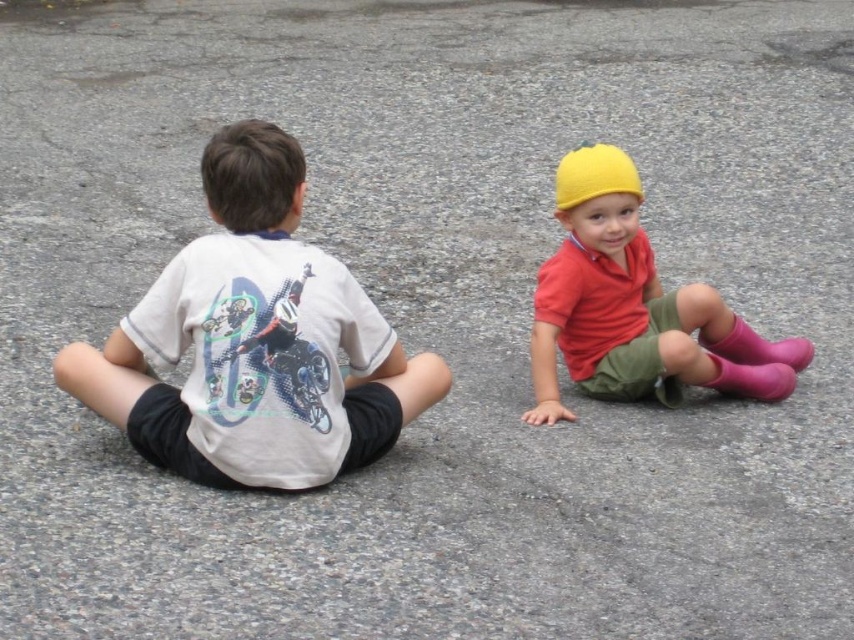
Question: Among these objects, which one is nearest to the camera?

Choices:
 (A) pink rubber boots at lower right
 (B) yellow knit hat at upper right

Answer: (B)

Question: Which object appears farthest from the camera in this image?

Choices:
 (A) pink rubber boot at lower right
 (B) pink rubber boots at lower right

Answer: (B)

Question: Is white matte t-shirt at left thinner than pink rubber boots at lower right?

Choices:
 (A) yes
 (B) no

Answer: (B)

Question: Can you confirm if white matte t-shirt at left is positioned to the left of pink rubber boots at lower right?

Choices:
 (A) yes
 (B) no

Answer: (A)

Question: Which of the following is the farthest from the observer?

Choices:
 (A) (585, 184)
 (B) (734, 378)

Answer: (B)

Question: Does yellow knit hat at upper right have a smaller size compared to pink rubber boot at lower right?

Choices:
 (A) no
 (B) yes

Answer: (A)